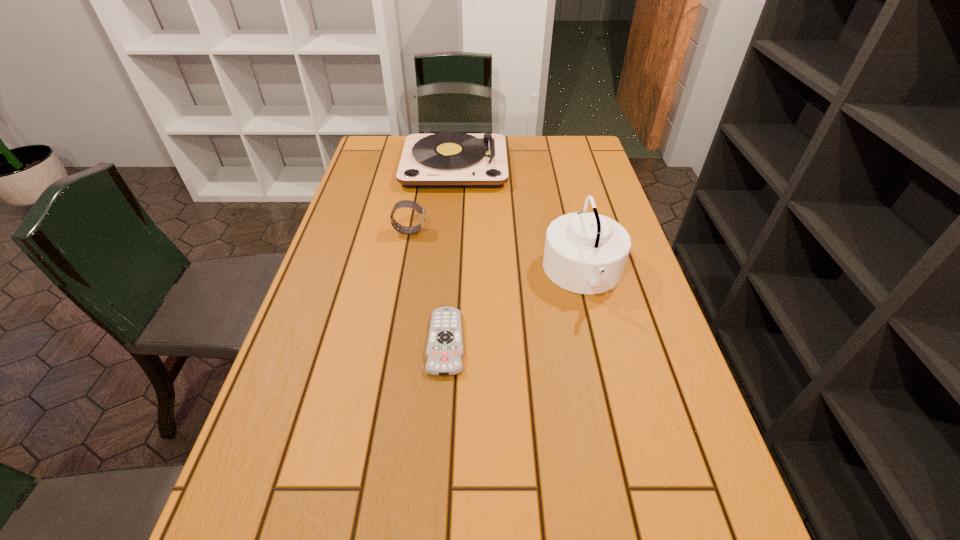
This screenshot has width=960, height=540. I want to click on free space located on the spout of the rightmost object, so click(x=383, y=274).

At what (x,y) coordinates should I click in order to perform the action: click on free location located on the face of the third nearest object. Please return your answer as a coordinate pair (x, y). The width and height of the screenshot is (960, 540). Looking at the image, I should click on (544, 231).

At what (x,y) coordinates should I click in order to perform the action: click on blank area located on the right of the shortest object. Please return your answer as a coordinate pair (x, y). This screenshot has width=960, height=540. Looking at the image, I should click on [x=646, y=342].

You are a GUI agent. You are given a task and a screenshot of the screen. Output one action in this format:
    pyautogui.click(x=<x>, y=<y>)
    Task: Click on the object positioned at the far edge
    Image resolution: width=960 pixels, height=540 pixels.
    Given the screenshot: What is the action you would take?
    pyautogui.click(x=450, y=159)

Find the location of a particular element. The image size is (960, 540). record player located in the left edge section of the desktop is located at coordinates (450, 159).

This screenshot has height=540, width=960. In order to click on watch that is at the left edge in this screenshot , I will do `click(404, 203)`.

Where is `object that is at the right edge`? object that is at the right edge is located at coordinates (586, 253).

In order to click on object that is at the far left corner in this screenshot , I will do `click(450, 159)`.

In the image, there is a desktop. What are the coordinates of `vacant space at the far edge` in the screenshot? It's located at (520, 163).

At what (x,y) coordinates should I click in order to perform the action: click on vacant space at the left edge of the desktop. Please return your answer as a coordinate pair (x, y). Looking at the image, I should click on (383, 258).